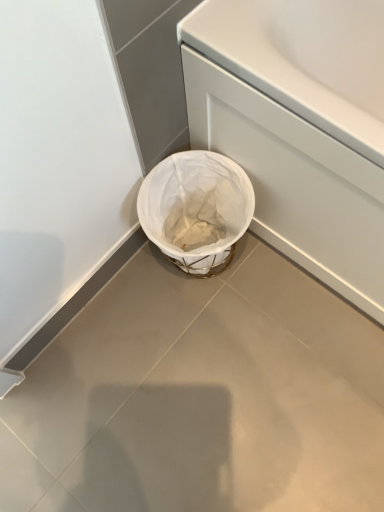
Where is `free region on the left part of white fabric basket at lower center`? free region on the left part of white fabric basket at lower center is located at coordinates (125, 297).